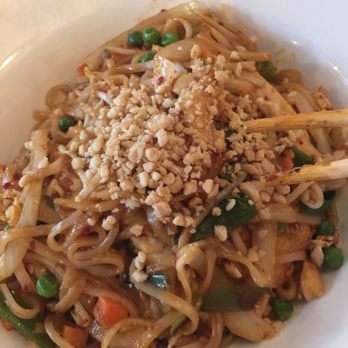
Locate an element on the screen. The image size is (348, 348). chopsticks is located at coordinates (311, 173), (305, 121).